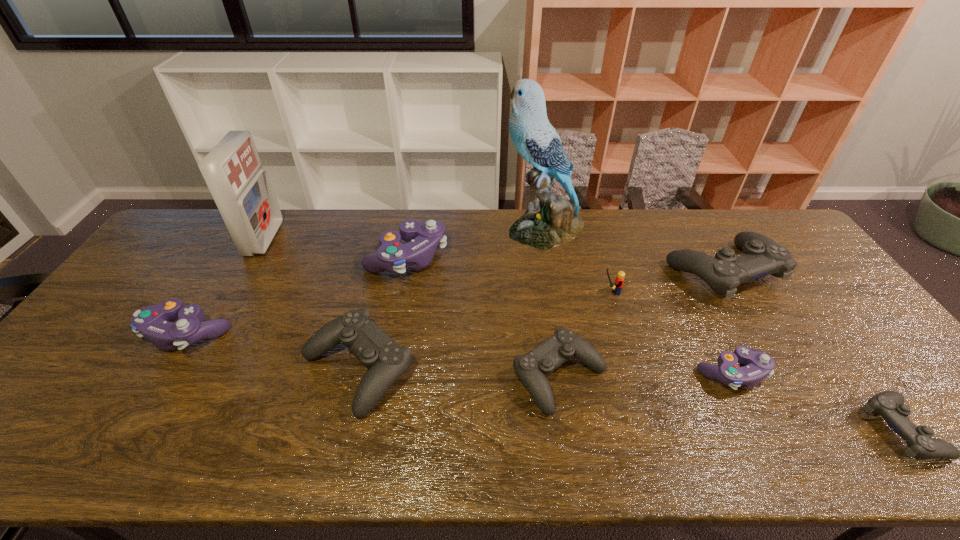
Identify which object is located as the nearest to the second smallest purple control. Please provide its 2D coordinates. Your answer should be formatted as a tuple, i.e. [(x, y)], where the tuple contains the x and y coordinates of a point satisfying the conditions above.

[(232, 170)]

This screenshot has width=960, height=540. Identify the location of the sixth closest object to the smallest purple control. (423, 238).

Find the location of `control that is the fifth closest to the red first-aid kit`. control that is the fifth closest to the red first-aid kit is located at coordinates (762, 256).

Locate an element on the screen. control that is the fifth closest one to the yellow Lego is located at coordinates (387, 361).

Locate which purple control is the third closest to the yellow Lego. Please provide its 2D coordinates. Your answer should be formatted as a tuple, i.e. [(x, y)], where the tuple contains the x and y coordinates of a point satisfying the conditions above.

[(152, 322)]

Where is `the second closest purple control to the leftmost control`? The height and width of the screenshot is (540, 960). the second closest purple control to the leftmost control is located at coordinates (759, 365).

Where is `gray control identified as the fourth closest to the first-aid kit`? Image resolution: width=960 pixels, height=540 pixels. gray control identified as the fourth closest to the first-aid kit is located at coordinates (889, 404).

Identify which gray control is the second nearest to the parakeet. Please provide its 2D coordinates. Your answer should be formatted as a tuple, i.e. [(x, y)], where the tuple contains the x and y coordinates of a point satisfying the conditions above.

[(532, 368)]

I want to click on free region that satisfies the following two spatial constraints: 1. on the front-facing side of the second gray control from left to right; 2. on the left side of the first-aid kit, so tap(185, 376).

Identify the location of vacant space that satisfies the following two spatial constraints: 1. on the back side of the smallest purple control; 2. on the face of the tallest object. (660, 228).